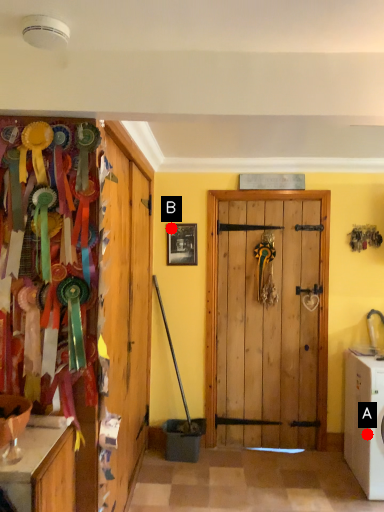
Question: Two points are circled on the image, labeled by A and B beside each circle. Among these points, which one is nearest to the camera?

Choices:
 (A) A is closer
 (B) B is closer

Answer: (A)